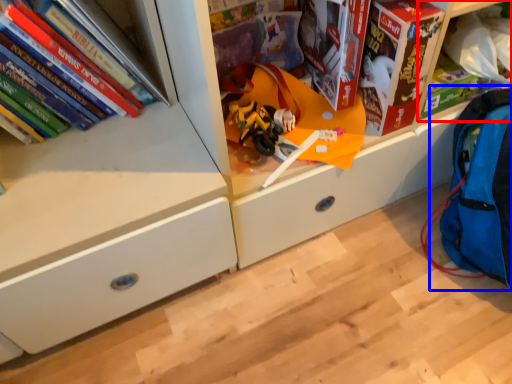
Question: Which object is further to the camera taking this photo, shelf (highlighted by a red box) or backpack (highlighted by a blue box)?

Choices:
 (A) shelf
 (B) backpack

Answer: (A)